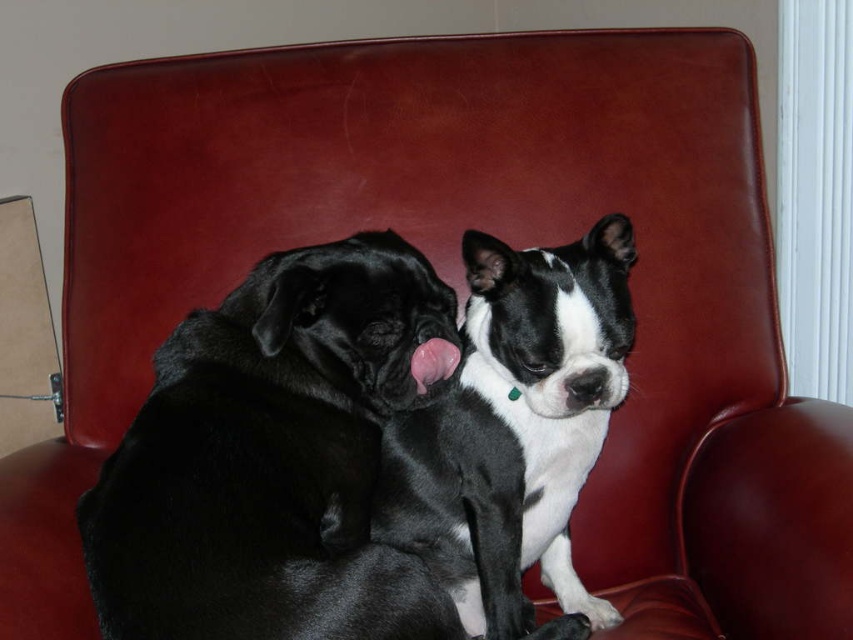
You are a photographer trying to capture the black fur dog at left and the Boston Terrier at right sitting on the red leather armchair. If you want to focus on the black fur dog at left, where should you aim your camera? Is it towards the point at coordinates (274, 458) or somewhere else?

The black fur dog at left is located at point (274, 458), so you should aim your camera towards that coordinate to focus on it.

You are observing two dogs sitting on a red leather armchair. The dogs are the black fur dog at left and the Boston Terrier with green collar on the right. Based on their positions, which dog is closer to the left edge of the armchair?

The black fur dog at left is closer to the left edge of the armchair because it is positioned at point (274, 458), which is further to the left compared to the Boston Terrier on the right.

You are looking at the two dogs on the red leather armchair. Which of the two points, point 1 at coordinates [279,557] or point 2 at coordinates [496,368], is closer to you?

Point 1 at coordinates [279,557] is closer to the viewer than point 2 at coordinates [496,368].